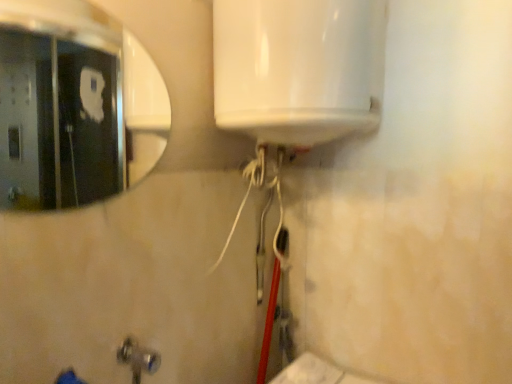
What do you see at coordinates (138, 358) in the screenshot?
I see `brushed metal faucet at lower left` at bounding box center [138, 358].

Find the location of a particular element. brushed metal faucet at lower left is located at coordinates coord(138,358).

The height and width of the screenshot is (384, 512). Describe the element at coordinates (60, 105) in the screenshot. I see `silver/metallic mirror at upper left` at that location.

Based on the photo, measure the distance between point (5, 118) and camera.

Point (5, 118) is 6.86 feet from camera.

Locate an element on the screen. The width and height of the screenshot is (512, 384). silver/metallic mirror at upper left is located at coordinates [60, 105].

In order to face silver/metallic mirror at upper left, should I rotate leftwards or rightwards?

You should look left and rotate roughly 20.490 degrees.

I want to click on brushed metal faucet at lower left, so click(138, 358).

Consider the image. Between silver/metallic mirror at upper left and brushed metal faucet at lower left, which one appears on the left side from the viewer's perspective?

Positioned to the left is silver/metallic mirror at upper left.

Is silver/metallic mirror at upper left closer to camera compared to brushed metal faucet at lower left?

No, it is behind brushed metal faucet at lower left.

Between point (38, 129) and point (126, 339), which one is positioned in front?

The point (126, 339) is more forward.

From the image's perspective, which one is positioned higher, silver/metallic mirror at upper left or brushed metal faucet at lower left?

silver/metallic mirror at upper left.

From a real-world perspective, is silver/metallic mirror at upper left above or below brushed metal faucet at lower left?

In terms of real-world spatial position, silver/metallic mirror at upper left is above brushed metal faucet at lower left.

Does silver/metallic mirror at upper left have a lesser width compared to brushed metal faucet at lower left?

Yes, silver/metallic mirror at upper left is thinner than brushed metal faucet at lower left.

Does silver/metallic mirror at upper left have a greater height compared to brushed metal faucet at lower left?

Indeed, silver/metallic mirror at upper left has a greater height compared to brushed metal faucet at lower left.

Considering the relative sizes of silver/metallic mirror at upper left and brushed metal faucet at lower left in the image provided, is silver/metallic mirror at upper left bigger than brushed metal faucet at lower left?

Incorrect, silver/metallic mirror at upper left is not larger than brushed metal faucet at lower left.

Consider the image. Is silver/metallic mirror at upper left positioned beyond the bounds of brushed metal faucet at lower left?

That's correct, silver/metallic mirror at upper left is outside of brushed metal faucet at lower left.

Is silver/metallic mirror at upper left far away from brushed metal faucet at lower left?

Yes, silver/metallic mirror at upper left is far from brushed metal faucet at lower left.

Is silver/metallic mirror at upper left turned away from brushed metal faucet at lower left?

No.

At what (x,y) coordinates should I click in order to perform the action: click on mirror behind the brushed metal faucet at lower left. Please return your answer as a coordinate pair (x, y). Image resolution: width=512 pixels, height=384 pixels. Looking at the image, I should click on (60, 105).

Does brushed metal faucet at lower left appear on the left side of silver/metallic mirror at upper left?

Incorrect, brushed metal faucet at lower left is not on the left side of silver/metallic mirror at upper left.

Does brushed metal faucet at lower left lie behind silver/metallic mirror at upper left?

No, it is in front of silver/metallic mirror at upper left.

Is point (140, 351) positioned before point (65, 23)?

Yes, it is in front of point (65, 23).

From the image's perspective, is brushed metal faucet at lower left positioned above or below silver/metallic mirror at upper left?

Based on their image positions, brushed metal faucet at lower left is located beneath silver/metallic mirror at upper left.

From a real-world perspective, who is located higher, brushed metal faucet at lower left or silver/metallic mirror at upper left?

silver/metallic mirror at upper left is physically above.

Based on the photo, does brushed metal faucet at lower left have a lesser width compared to silver/metallic mirror at upper left?

Incorrect, the width of brushed metal faucet at lower left is not less than that of silver/metallic mirror at upper left.

Does brushed metal faucet at lower left have a greater height compared to silver/metallic mirror at upper left?

No.

Considering the sizes of objects brushed metal faucet at lower left and silver/metallic mirror at upper left in the image provided, who is bigger, brushed metal faucet at lower left or silver/metallic mirror at upper left?

Bigger between the two is brushed metal faucet at lower left.

Is silver/metallic mirror at upper left inside brushed metal faucet at lower left?

No, silver/metallic mirror at upper left is not inside brushed metal faucet at lower left.

Would you consider brushed metal faucet at lower left to be distant from silver/metallic mirror at upper left?

Absolutely, brushed metal faucet at lower left is distant from silver/metallic mirror at upper left.

Is brushed metal faucet at lower left facing towards silver/metallic mirror at upper left?

No, brushed metal faucet at lower left does not turn towards silver/metallic mirror at upper left.

Can you tell me how much brushed metal faucet at lower left and silver/metallic mirror at upper left differ in facing direction?

brushed metal faucet at lower left and silver/metallic mirror at upper left are facing 57.6 degrees away from each other.

Find the location of a particular element. The width and height of the screenshot is (512, 384). mirror above the brushed metal faucet at lower left (from a real-world perspective) is located at coordinates (60, 105).

Locate an element on the screen. plumbing fixture below the silver/metallic mirror at upper left (from the image's perspective) is located at coordinates (138, 358).

Identify the location of mirror that appears behind the brushed metal faucet at lower left. (60, 105).